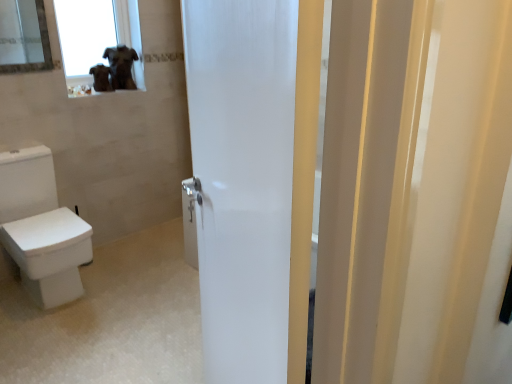
What is the approximate height of transparent glass window at upper left?

21.73 inches.

Image resolution: width=512 pixels, height=384 pixels. Describe the element at coordinates (97, 35) in the screenshot. I see `transparent glass window at upper left` at that location.

Locate an element on the screen. This screenshot has width=512, height=384. transparent glass window at upper left is located at coordinates (97, 35).

Where is `transparent glass window at upper left`? Image resolution: width=512 pixels, height=384 pixels. transparent glass window at upper left is located at coordinates (97, 35).